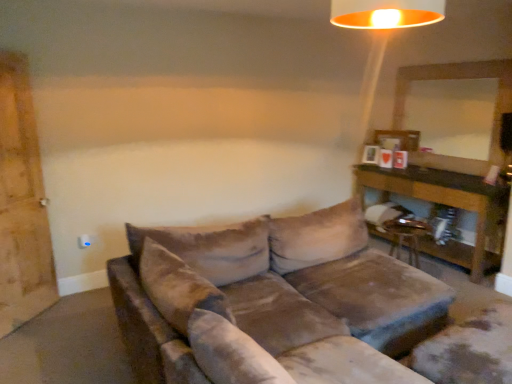
Where is `velvet brown couch at center`? This screenshot has height=384, width=512. velvet brown couch at center is located at coordinates point(267,296).

Measure the distance between point (377, 190) and camera.

Point (377, 190) and camera are 4.75 meters apart.

What is the approximate height of brown wooden table at right?

33.12 inches.

The height and width of the screenshot is (384, 512). Describe the element at coordinates (22, 203) in the screenshot. I see `wooden barn door at left` at that location.

Find the location of a particular element. metallic gold swivel chair at lower right is located at coordinates (398, 228).

In terms of width, does brown wooden table at right look wider or thinner when compared to metallic gold lampshade at upper center?

brown wooden table at right is wider than metallic gold lampshade at upper center.

Does brown wooden table at right have a larger size compared to metallic gold lampshade at upper center?

Yes, brown wooden table at right is bigger than metallic gold lampshade at upper center.

From a real-world perspective, which object rests below the other?

In real-world perspective, brown wooden table at right is lower.

How different are the orientations of brown wooden table at right and metallic gold lampshade at upper center in degrees?

They differ by 169 degrees in their facing directions.

Does velvet brown couch at center have a greater height compared to metallic gold swivel chair at lower right?

Indeed, velvet brown couch at center has a greater height compared to metallic gold swivel chair at lower right.

I want to click on swivel chair that is on the right side of velvet brown couch at center, so click(x=398, y=228).

Is point (268, 293) closer to camera compared to point (406, 227)?

Yes, it is in front of point (406, 227).

Is velvet brown couch at center to the left or to the right of metallic gold swivel chair at lower right in the image?

Based on their positions, velvet brown couch at center is located to the left of metallic gold swivel chair at lower right.

Can you confirm if metallic gold lampshade at upper center is shorter than metallic gold swivel chair at lower right?

Yes.

Relative to metallic gold swivel chair at lower right, is metallic gold lampshade at upper center in front or behind?

metallic gold lampshade at upper center is positioned closer to the viewer than metallic gold swivel chair at lower right.

Is metallic gold lampshade at upper center thinner than metallic gold swivel chair at lower right?

No, metallic gold lampshade at upper center is not thinner than metallic gold swivel chair at lower right.

From the image's perspective, does wooden barn door at left appear lower than brown wooden table at right?

Actually, wooden barn door at left appears above brown wooden table at right in the image.

Is point (0, 125) closer or farther from the camera than point (362, 169)?

Point (0, 125) is positioned closer to the camera compared to point (362, 169).

Is wooden barn door at left smaller than brown wooden table at right?

Indeed, wooden barn door at left has a smaller size compared to brown wooden table at right.

Is wooden barn door at left to the right of brown wooden table at right from the viewer's perspective?

In fact, wooden barn door at left is to the left of brown wooden table at right.

Between wooden barn door at left and velvet brown couch at center, which one is positioned in front?

velvet brown couch at center.

From a real-world perspective, is wooden barn door at left on top of velvet brown couch at center?

Correct, in the physical world, wooden barn door at left is higher than velvet brown couch at center.

Does point (22, 278) come closer to viewer compared to point (342, 237)?

Yes, point (22, 278) is closer to viewer.

Is wooden barn door at left taller or shorter than velvet brown couch at center?

Considering their sizes, wooden barn door at left has more height than velvet brown couch at center.

In the scene shown: Is metallic gold lampshade at upper center closer to camera compared to wooden barn door at left?

That is True.

Does metallic gold lampshade at upper center contain wooden barn door at left?

No.

Is metallic gold lampshade at upper center far from wooden barn door at left?

metallic gold lampshade at upper center is far away from wooden barn door at left.

Considering the relative sizes of metallic gold swivel chair at lower right and metallic gold lampshade at upper center in the image provided, is metallic gold swivel chair at lower right thinner than metallic gold lampshade at upper center?

Yes.

Which object is positioned more to the left, metallic gold swivel chair at lower right or metallic gold lampshade at upper center?

metallic gold lampshade at upper center is more to the left.

Find the location of a particular element. The width and height of the screenshot is (512, 384). table that is under the metallic gold lampshade at upper center (from a real-world perspective) is located at coordinates (442, 204).

This screenshot has width=512, height=384. What are the coordinates of `studio couch lying below the metallic gold swivel chair at lower right (from the image's perspective)` in the screenshot? It's located at (267, 296).

Which object lies further to the anchor point metallic gold swivel chair at lower right, metallic gold lampshade at upper center or brown wooden table at right?

metallic gold lampshade at upper center.

Which object lies nearer to the anchor point metallic gold lampshade at upper center, wooden barn door at left or metallic gold swivel chair at lower right?

Based on the image, metallic gold swivel chair at lower right appears to be nearer to metallic gold lampshade at upper center.

Based on their spatial positions, is metallic gold lampshade at upper center or metallic gold swivel chair at lower right further from brown wooden table at right?

metallic gold lampshade at upper center is positioned further to the anchor brown wooden table at right.

Looking at the image, which one is located further to metallic gold lampshade at upper center, wooden barn door at left or brown wooden table at right?

wooden barn door at left is positioned further to the anchor metallic gold lampshade at upper center.

From the image, which object appears to be nearer to wooden barn door at left, brown wooden table at right or metallic gold swivel chair at lower right?

A: metallic gold swivel chair at lower right.

Based on their spatial positions, is metallic gold swivel chair at lower right or velvet brown couch at center further from brown wooden table at right?

velvet brown couch at center is further to brown wooden table at right.

When comparing their distances from metallic gold lampshade at upper center, does metallic gold swivel chair at lower right or wooden barn door at left seem further?

wooden barn door at left is further to metallic gold lampshade at upper center.

Considering their positions, is metallic gold swivel chair at lower right positioned further to metallic gold lampshade at upper center than brown wooden table at right?

metallic gold swivel chair at lower right is further to metallic gold lampshade at upper center.

You are a GUI agent. You are given a task and a screenshot of the screen. Output one action in this format:
    pyautogui.click(x=<x>, y=<y>)
    Task: Click on the swivel chair located between velvet brown couch at center and brown wooden table at right in the depth direction
    
    Given the screenshot: What is the action you would take?
    pyautogui.click(x=398, y=228)

The height and width of the screenshot is (384, 512). Identify the location of swivel chair between wooden barn door at left and brown wooden table at right. 398,228.

Where is `lamp between velvet brown couch at center and brown wooden table at right from front to back`? This screenshot has height=384, width=512. lamp between velvet brown couch at center and brown wooden table at right from front to back is located at coordinates (386, 13).

Locate an element on the screen. The image size is (512, 384). lamp situated between wooden barn door at left and metallic gold swivel chair at lower right from left to right is located at coordinates (386, 13).